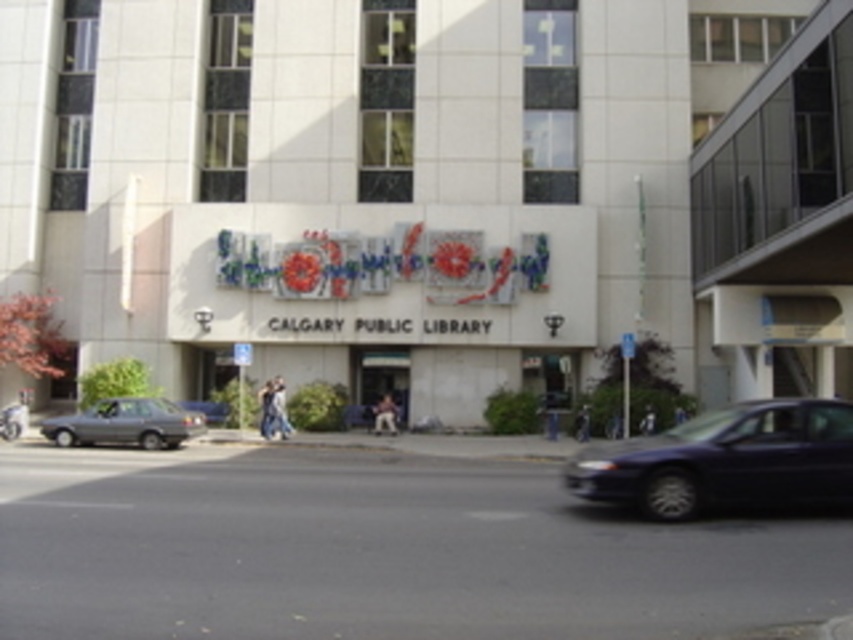
Question: Can you confirm if dark blue sedan at lower right is bigger than matte gray sedan at lower left?

Choices:
 (A) yes
 (B) no

Answer: (A)

Question: Can you confirm if dark blue sedan at lower right is positioned to the right of matte gray sedan at lower left?

Choices:
 (A) yes
 (B) no

Answer: (A)

Question: Which point is closer to the camera?

Choices:
 (A) (105, 400)
 (B) (355, 552)

Answer: (B)

Question: Can you confirm if metallic gray car at center is positioned to the left of dark blue sedan at lower right?

Choices:
 (A) no
 (B) yes

Answer: (B)

Question: Which point is closer to the camera taking this photo?

Choices:
 (A) [670, 486]
 (B) [186, 428]

Answer: (A)

Question: Among these objects, which one is farthest from the camera?

Choices:
 (A) metallic gray car at center
 (B) matte gray sedan at lower left

Answer: (B)